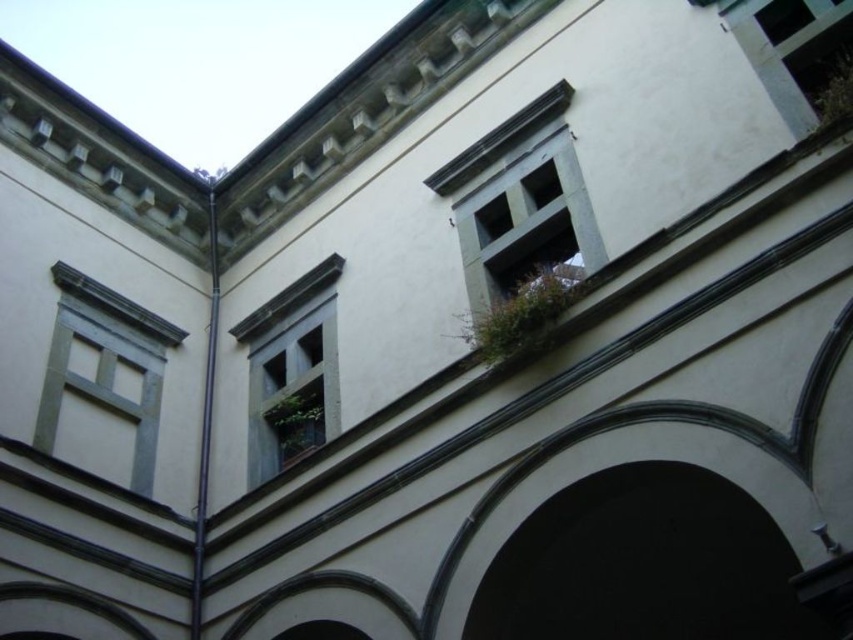
Question: Among these points, which one is farthest from the camera?

Choices:
 (A) (602, 244)
 (B) (57, 397)

Answer: (B)

Question: Observing the image, what is the correct spatial positioning of gray stone window at upper center in reference to matte gray window at upper left?

Choices:
 (A) right
 (B) left

Answer: (A)

Question: Which of the following is the closest to the observer?

Choices:
 (A) gray stone window at upper center
 (B) matte gray window at upper left
 (C) blue painted wood window at center

Answer: (A)

Question: Is gray stone window at upper center below matte gray window at upper left?

Choices:
 (A) yes
 (B) no

Answer: (B)

Question: Is gray stone window at upper center to the right of matte gray window at upper left from the viewer's perspective?

Choices:
 (A) no
 (B) yes

Answer: (B)

Question: Which point is farther from the camera taking this photo?

Choices:
 (A) (109, 346)
 (B) (323, 419)
 (C) (595, 240)

Answer: (A)